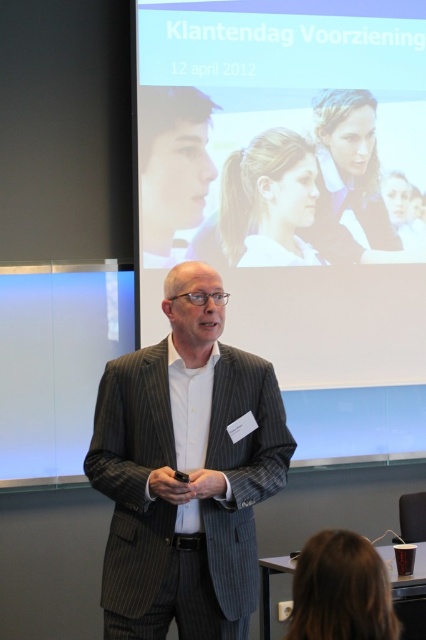
Can you confirm if striped wool suit at center is positioned to the left of matte black face at upper left?

In fact, striped wool suit at center is to the right of matte black face at upper left.

Who is lower down, striped wool suit at center or matte black face at upper left?

striped wool suit at center is lower down.

This screenshot has height=640, width=426. Identify the location of striped wool suit at center. (186, 470).

Identify the location of striped wool suit at center. (186, 470).